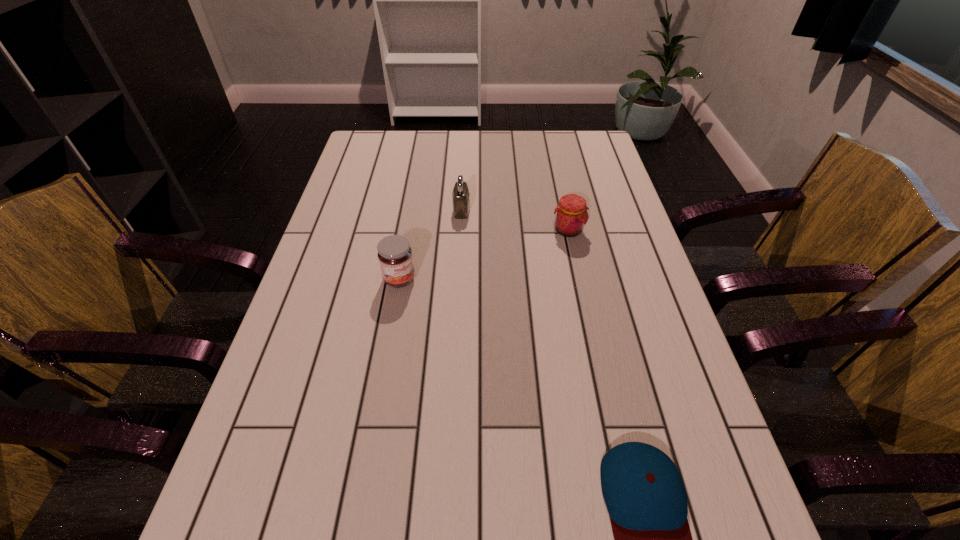
Where is `the farthest object`? This screenshot has height=540, width=960. the farthest object is located at coordinates (460, 196).

Where is `padlock`? The height and width of the screenshot is (540, 960). padlock is located at coordinates (460, 196).

Locate an element on the screen. This screenshot has height=540, width=960. the nearer jam is located at coordinates (395, 257).

Locate an element on the screen. This screenshot has width=960, height=540. the leftmost object is located at coordinates (395, 257).

At what (x,y) coordinates should I click in order to perform the action: click on the shorter jam. Please return your answer as a coordinate pair (x, y). Image resolution: width=960 pixels, height=540 pixels. Looking at the image, I should click on (571, 215).

Where is `the farther jam`? the farther jam is located at coordinates (571, 215).

Where is `vacant space situated at the front of the padlock near the keyhole`? This screenshot has width=960, height=540. vacant space situated at the front of the padlock near the keyhole is located at coordinates point(538,210).

The width and height of the screenshot is (960, 540). What are the coordinates of `vacant space located on the front of the third farthest object` in the screenshot? It's located at (384, 368).

Identify the location of free space located 0.270m on the left of the third nearest object. This screenshot has width=960, height=540. coord(455,230).

Find the location of a particular element. The image size is (960, 540). object located at the right edge is located at coordinates (571, 215).